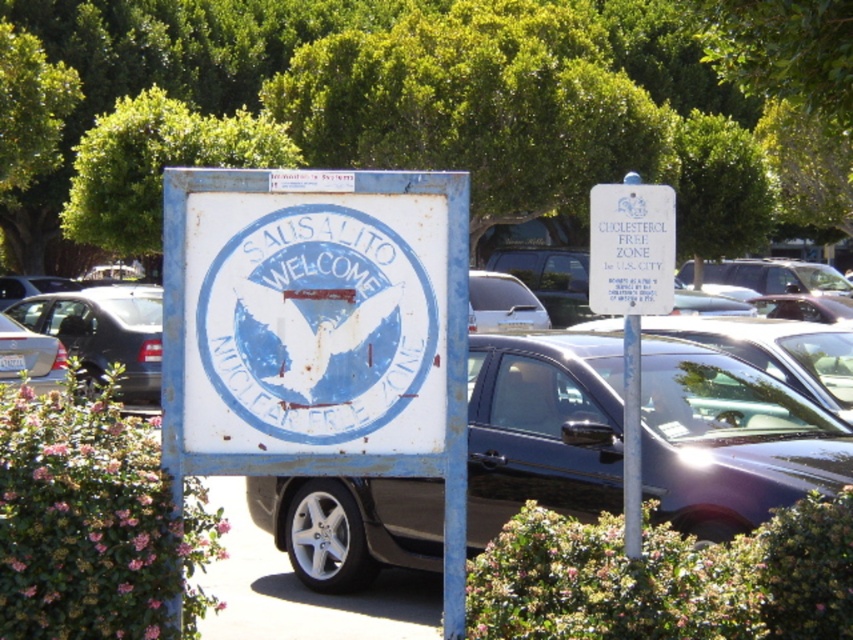
Question: Which point is closer to the camera?

Choices:
 (A) shiny silver sedan at left
 (B) metallic silver sedan at center
 (C) satin silver car at center

Answer: (C)

Question: Which point is closer to the camera?

Choices:
 (A) satin silver car at center
 (B) shiny silver sedan at left

Answer: (A)

Question: Which point is farther to the camera?

Choices:
 (A) metallic silver sedan at center
 (B) shiny silver sedan at left
 (C) metallic gray sedan at center
 (D) silver metallic sedan at left

Answer: (A)

Question: Considering the relative positions of shiny silver sedan at left and metallic silver sedan at center in the image provided, where is shiny silver sedan at left located with respect to metallic silver sedan at center?

Choices:
 (A) below
 (B) above

Answer: (A)

Question: Does shiny silver sedan at left appear over satin silver car at center?

Choices:
 (A) no
 (B) yes

Answer: (A)

Question: Is metallic gray sedan at center wider than metallic silver sedan at center?

Choices:
 (A) yes
 (B) no

Answer: (B)